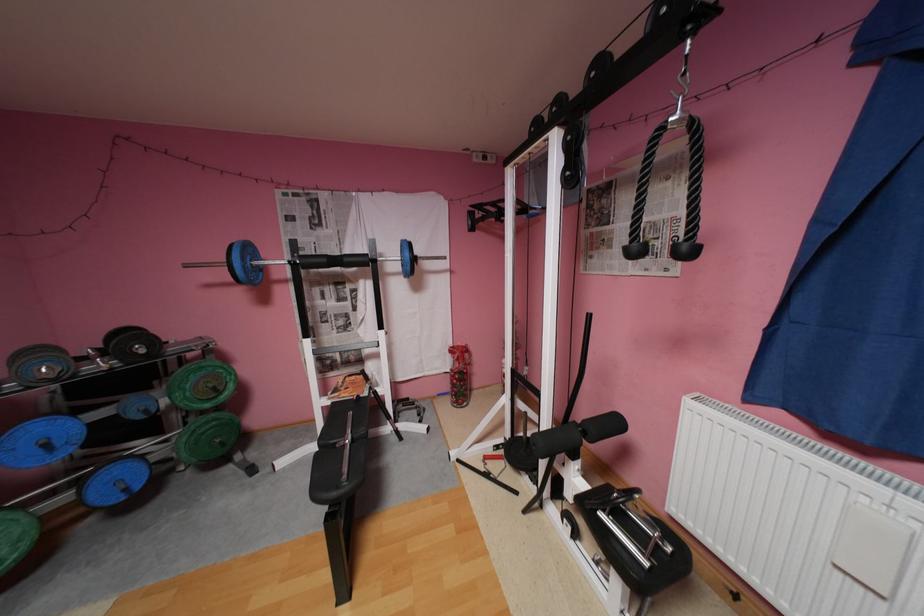
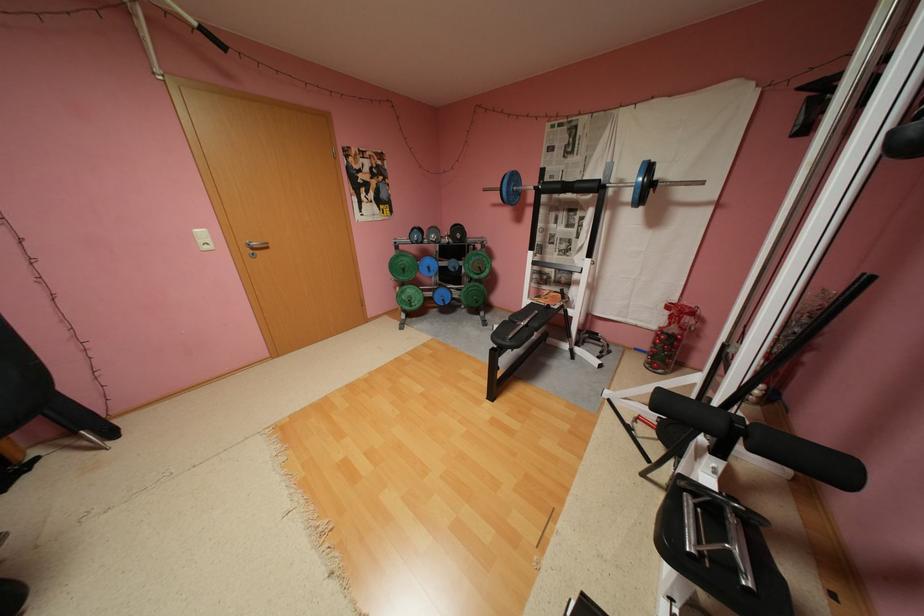
In the second image, find the point that corresponds to (x=68, y=443) in the first image.

(441, 269)